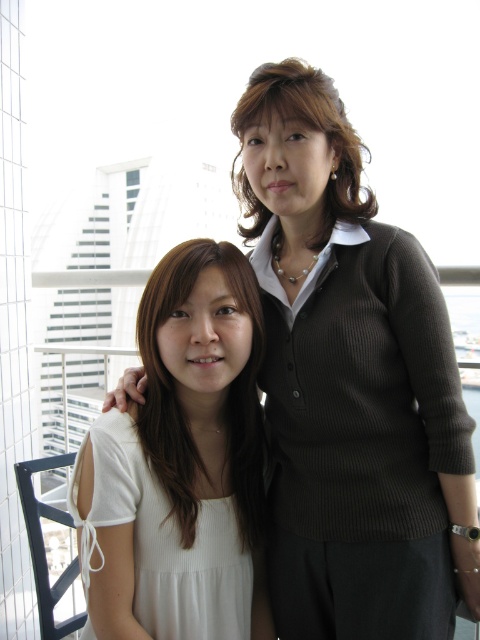
Question: Does matte brown sweater at center appear under matte brown hair at center?

Choices:
 (A) yes
 (B) no

Answer: (A)

Question: Which point is closer to the camera taking this photo?

Choices:
 (A) (276, 68)
 (B) (187, 272)
 (C) (108, 465)
 (D) (474, 556)

Answer: (C)

Question: Among these objects, which one is nearest to the camera?

Choices:
 (A) matte brown sweater at center
 (B) matte brown hair at center
 (C) white matte shirt at center

Answer: (A)

Question: Can you confirm if white ribbed dress at left is smaller than white matte shirt at center?

Choices:
 (A) yes
 (B) no

Answer: (B)

Question: Estimate the real-world distances between objects in this image. Which object is farther from the matte brown sweater at center?

Choices:
 (A) white matte shirt at center
 (B) matte brown hair at center

Answer: (B)

Question: In this image, where is white ribbed dress at left located relative to matte brown hair at center?

Choices:
 (A) above
 (B) below

Answer: (B)